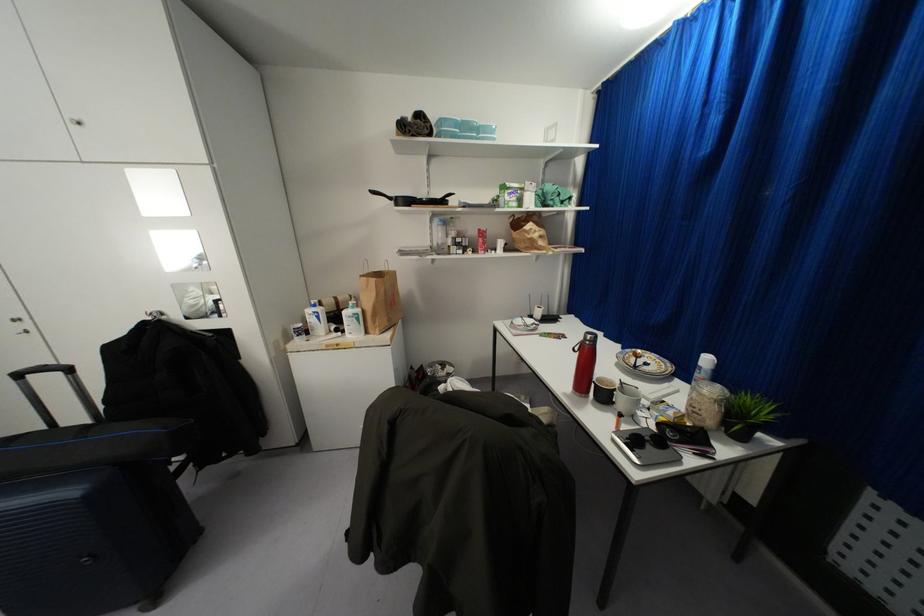
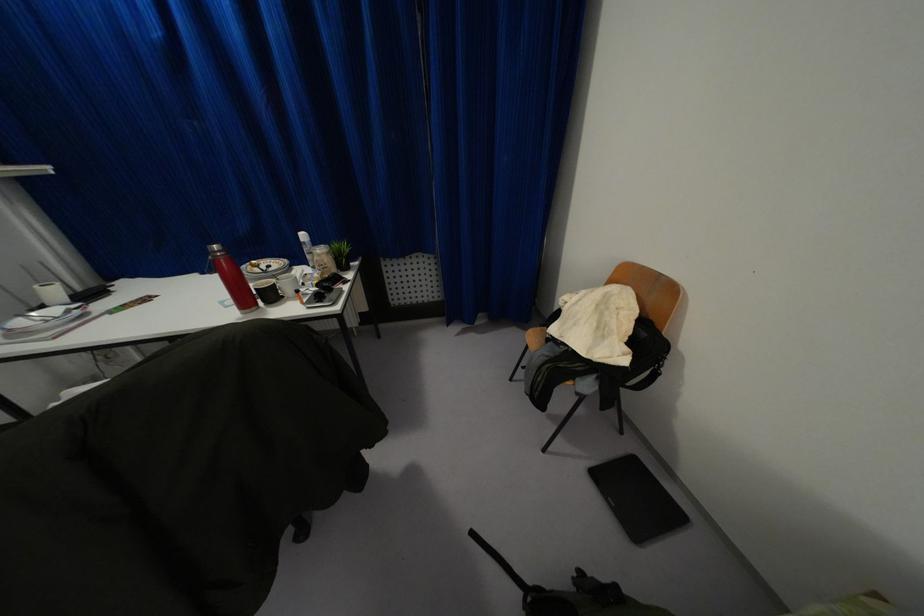
In the second image, find the point that corresponds to pixel 589 336 in the first image.

(214, 246)